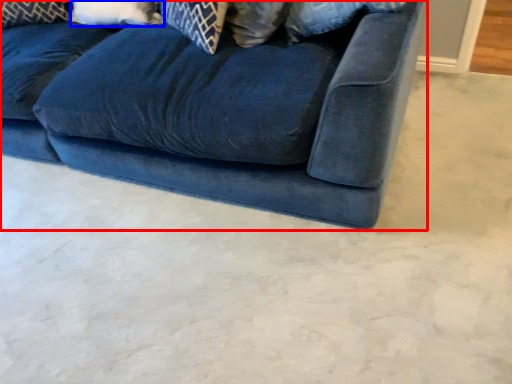
Question: Among these objects, which one is nearest to the camera, studio couch (highlighted by a red box) or pillow (highlighted by a blue box)?

Choices:
 (A) studio couch
 (B) pillow

Answer: (A)